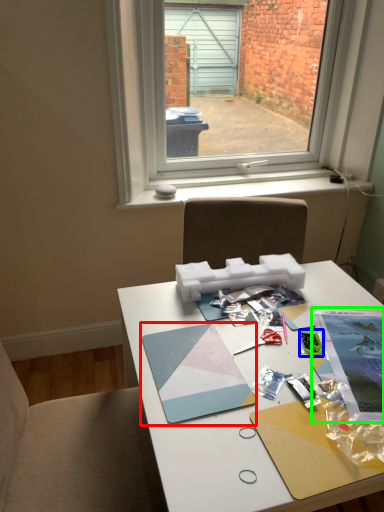
Question: Which is nearer to the magazine (highlighted by a red box)? stationery (highlighted by a blue box) or magazine (highlighted by a green box).

Choices:
 (A) stationery
 (B) magazine

Answer: (A)